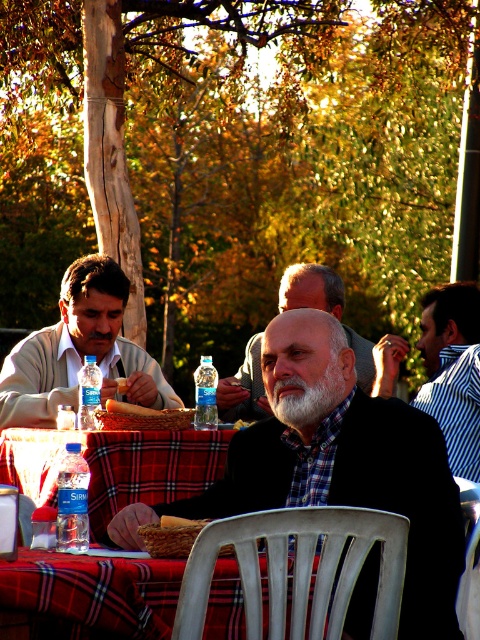
Who is taller, matte black jacket at center or whitehairbeard at center?

matte black jacket at center

Is matte black jacket at center smaller than whitehairbeard at center?

Incorrect, matte black jacket at center is not smaller in size than whitehairbeard at center.

Between point (241, 451) and point (336, 381), which one is positioned in front?

Point (336, 381)

Where is `matte black jacket at center`? matte black jacket at center is located at coordinates (337, 465).

Is point (49, 595) positioned before point (141, 420)?

That is True.

From the picture: Who is taller, red plaid tablecloth at center or brown woven basket at center?

With more height is red plaid tablecloth at center.

Between point (60, 609) and point (136, 424), which one is positioned behind?

Positioned behind is point (136, 424).

Locate an element on the screen. red plaid tablecloth at center is located at coordinates (90, 595).

Describe the element at coordinates (80, 352) in the screenshot. I see `matte gray sweater at left` at that location.

Can you confirm if matte gray sweater at left is bigger than striped shirt at center?

Yes, matte gray sweater at left is bigger than striped shirt at center.

Which is behind, point (112, 268) or point (445, 378)?

Positioned behind is point (112, 268).

The height and width of the screenshot is (640, 480). Identify the location of matte gray sweater at left. (x=80, y=352).